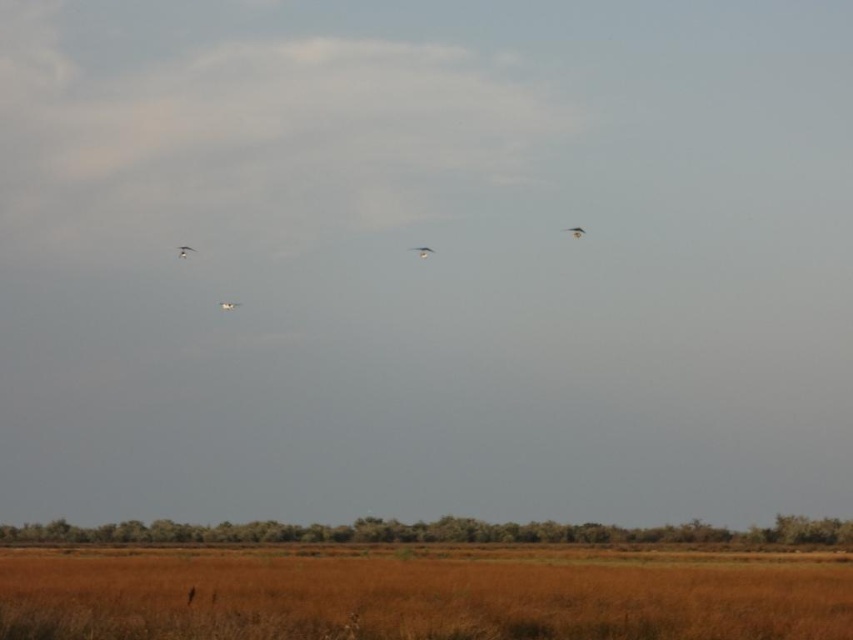
Question: Can you confirm if white feathered bird at center is positioned to the left of white glossy bird at center?

Choices:
 (A) no
 (B) yes

Answer: (A)

Question: Observing the image, what is the correct spatial positioning of smooth feathered bird at upper right in reference to white glossy bird at center?

Choices:
 (A) below
 (B) above

Answer: (B)

Question: Among these objects, which one is nearest to the camera?

Choices:
 (A) white glossy bird at center
 (B) white glossy bird at upper center
 (C) white feathered bird at center

Answer: (C)

Question: Considering the real-world distances, which object is closest to the white glossy bird at upper center?

Choices:
 (A) white glossy bird at center
 (B) smooth feathered bird at upper right
 (C) brown dry grass at lower center
 (D) white feathered bird at center

Answer: (A)

Question: Is brown dry grass at lower center above white feathered bird at center?

Choices:
 (A) yes
 (B) no

Answer: (B)

Question: Which object is the closest to the white glossy bird at center?

Choices:
 (A) white glossy bird at upper center
 (B) smooth feathered bird at upper right

Answer: (A)